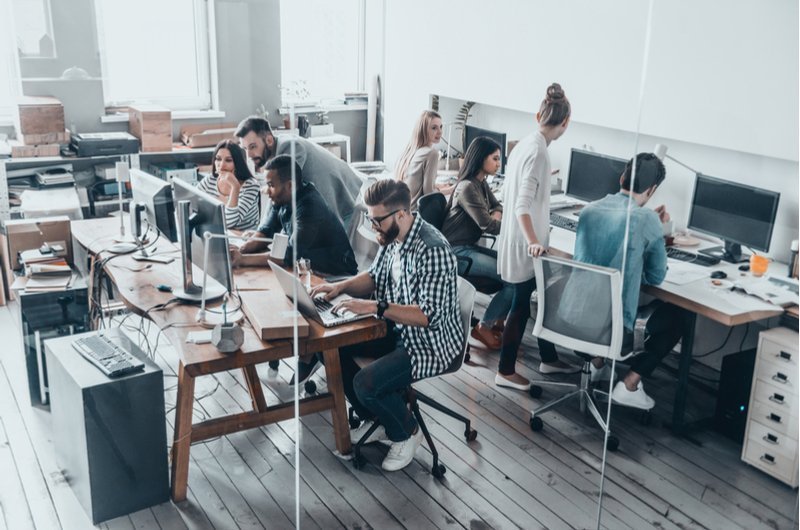
Find the location of a particular element. monitors is located at coordinates (209, 228), (160, 208), (490, 135), (586, 162), (738, 207).